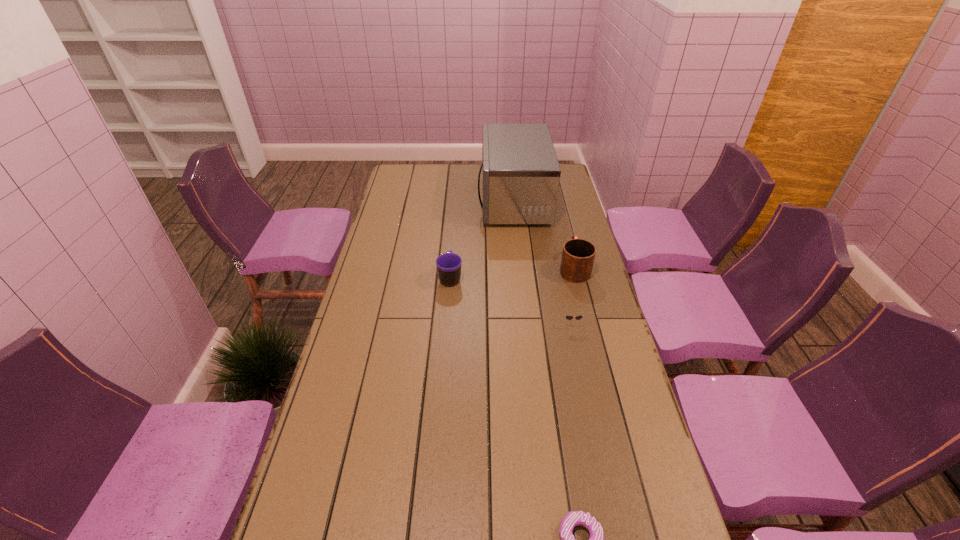
At what (x,y) coordinates should I click in order to perform the action: click on object that ranks as the second closest to the taller mug. Please return your answer as a coordinate pair (x, y). The height and width of the screenshot is (540, 960). Looking at the image, I should click on [x=521, y=174].

At what (x,y) coordinates should I click in order to perform the action: click on vacant space that satisfies the following two spatial constraints: 1. on the side of the fourth shortest object with the handle; 2. on the front-facing side of the tallest object. Please return your answer as a coordinate pair (x, y). Looking at the image, I should click on (557, 200).

Find the location of a particular element. The height and width of the screenshot is (540, 960). free space that satisfies the following two spatial constraints: 1. on the front-facing side of the tallest object; 2. on the side of the right mug with the handle is located at coordinates (521, 268).